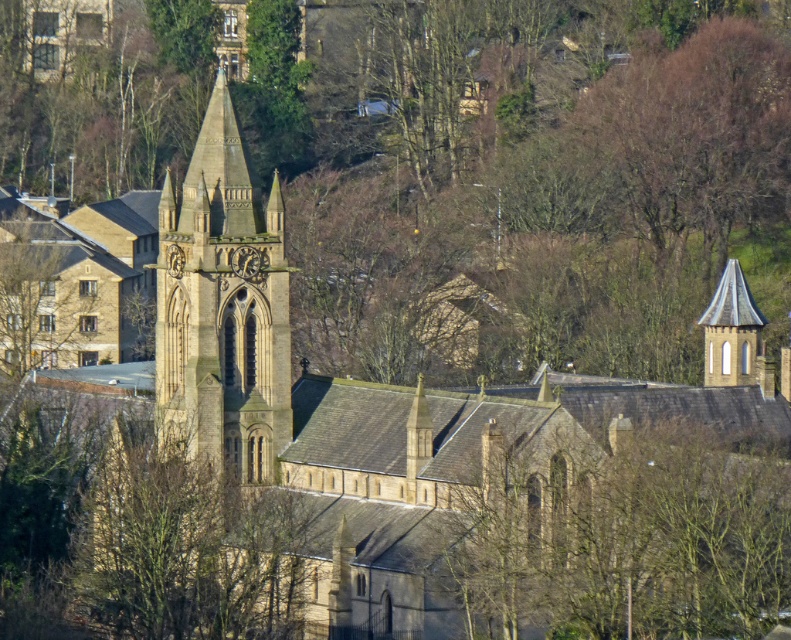
Question: Does green leafy tree at center have a larger size compared to brown stone tower at center?

Choices:
 (A) no
 (B) yes

Answer: (A)

Question: Is green leafy tree at center to the right of smooth gray stone tower at right from the viewer's perspective?

Choices:
 (A) yes
 (B) no

Answer: (B)

Question: Observing the image, what is the correct spatial positioning of green leafy tree at center in reference to brown stone tower at center?

Choices:
 (A) above
 (B) below

Answer: (B)

Question: Which point appears closest to the camera in this image?

Choices:
 (A) (561, 502)
 (B) (248, 451)
 (C) (717, 348)

Answer: (A)

Question: Which of the following is the farthest from the observer?

Choices:
 (A) (471, 492)
 (B) (732, 369)

Answer: (B)

Question: Which point is farther to the camera?

Choices:
 (A) (731, 282)
 (B) (634, 566)
 (C) (210, 344)

Answer: (A)